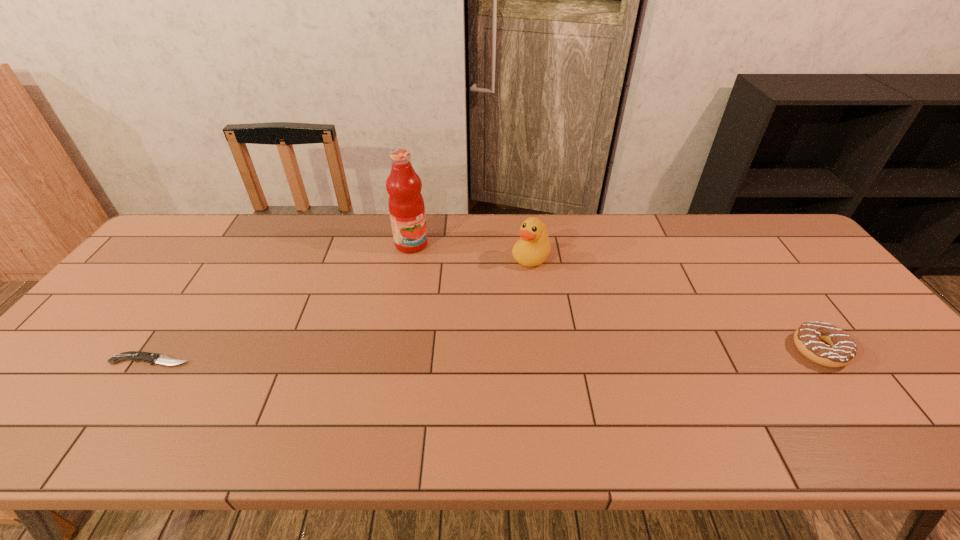
At what (x,y) coordinates should I click in order to perform the action: click on free space at the far edge of the desktop. Please return your answer as a coordinate pair (x, y). This screenshot has height=540, width=960. Looking at the image, I should click on (641, 254).

Image resolution: width=960 pixels, height=540 pixels. I want to click on blank area at the near edge, so click(314, 397).

Identify the location of vacant region at the left edge. The width and height of the screenshot is (960, 540). (171, 272).

The image size is (960, 540). I want to click on free space at the far left corner of the desktop, so click(201, 226).

Image resolution: width=960 pixels, height=540 pixels. I want to click on vacant space at the far right corner of the desktop, so click(760, 233).

At what (x,y) coordinates should I click in order to perform the action: click on vacant area between the rightmost object and the shortest object. Please return your answer as a coordinate pair (x, y). This screenshot has width=960, height=540. Looking at the image, I should click on (486, 355).

Where is `empty space that is in between the pocketknife and the doughnut`? empty space that is in between the pocketknife and the doughnut is located at coordinates (486, 355).

You are a GUI agent. You are given a task and a screenshot of the screen. Output one action in this format:
    pyautogui.click(x=<x>, y=<y>)
    Task: Click on the free space between the leftmost object and the duck
    The height and width of the screenshot is (540, 960).
    Given the screenshot: What is the action you would take?
    pyautogui.click(x=341, y=309)

Identify the location of free point between the third tallest object and the leftmost object. The image size is (960, 540). (486, 355).

Locate an element on the screen. The height and width of the screenshot is (540, 960). free space between the fruit juice and the rightmost object is located at coordinates (615, 297).